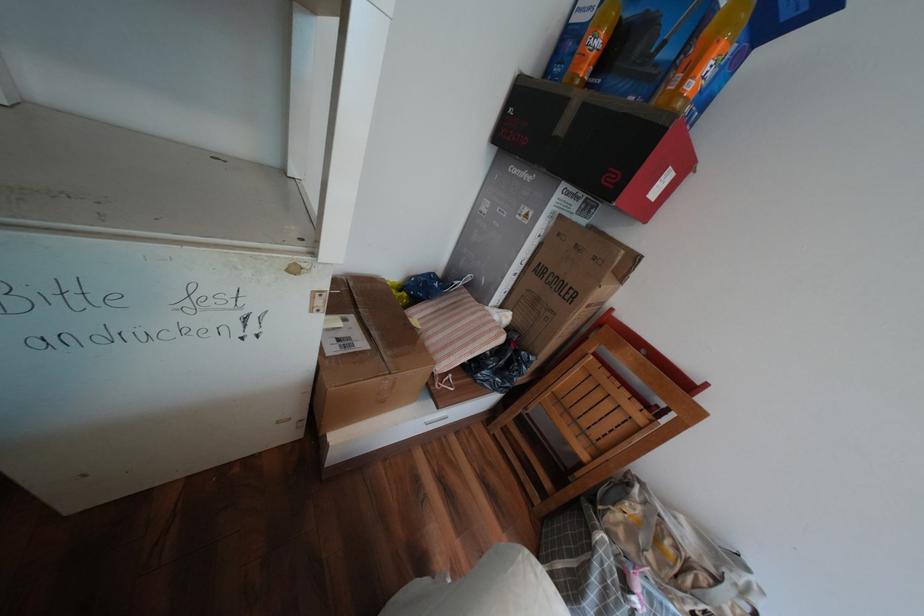
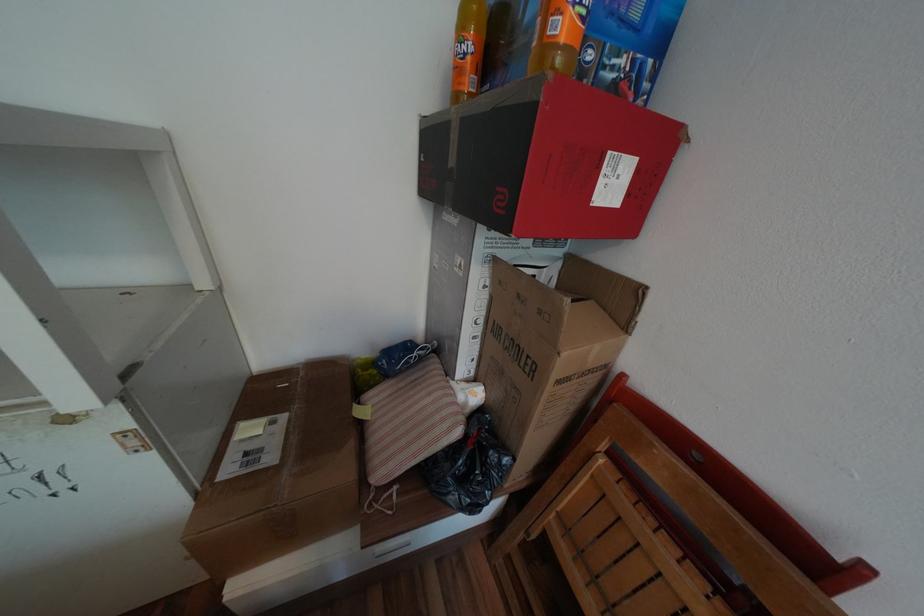
Where in the second image is the point corresponding to [500,330] from the first image?

(453, 419)